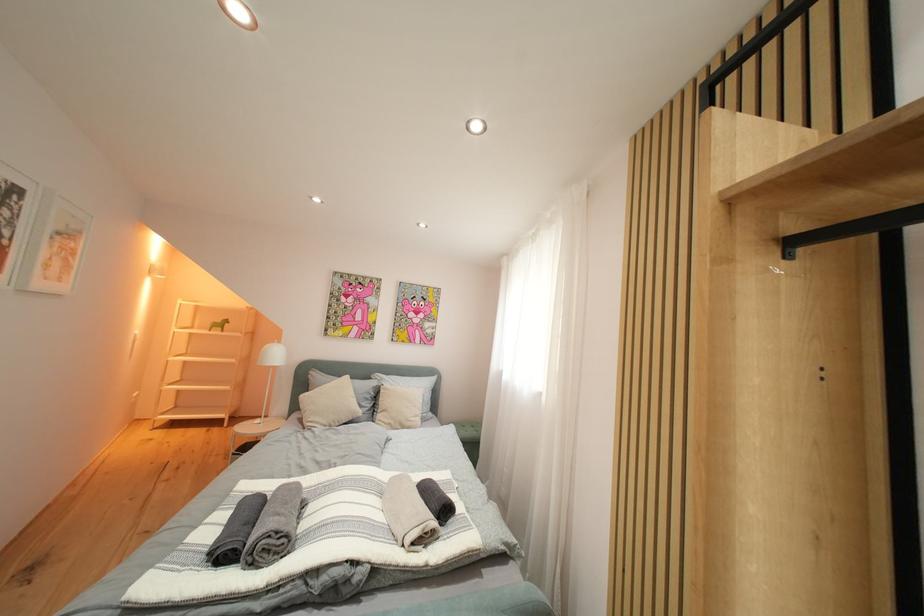
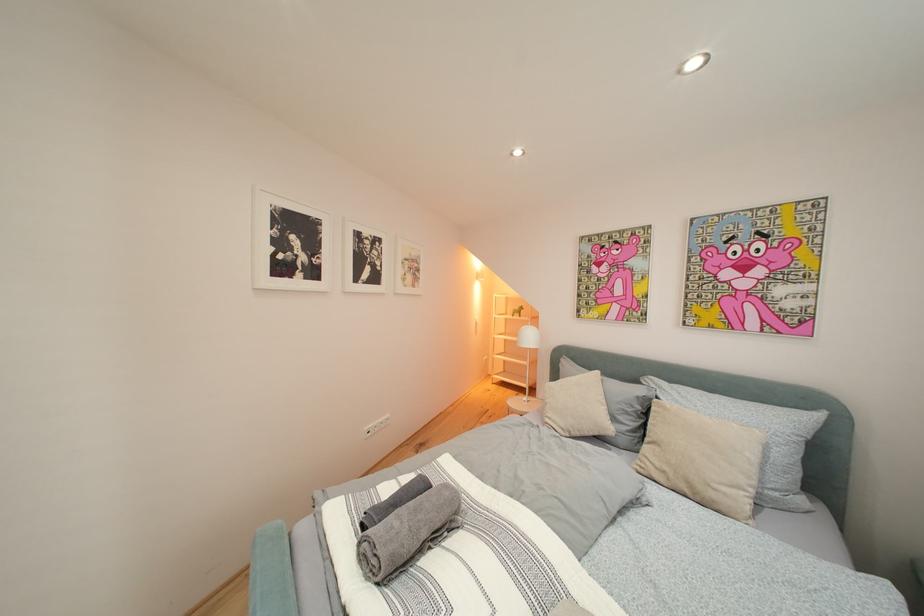
Question: The camera is either moving clockwise (left) or counter-clockwise (right) around the object. The first image is from the beginning of the video and the second image is from the end. Is the camera moving left or right when shooting the video?

Choices:
 (A) Left
 (B) Right

Answer: (B)